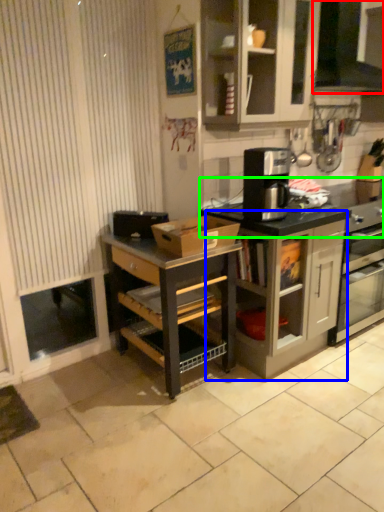
Question: Which is nearer to the vent (highlighted by a red box)? cabinetry (highlighted by a blue box) or countertop (highlighted by a green box).

Choices:
 (A) cabinetry
 (B) countertop

Answer: (B)